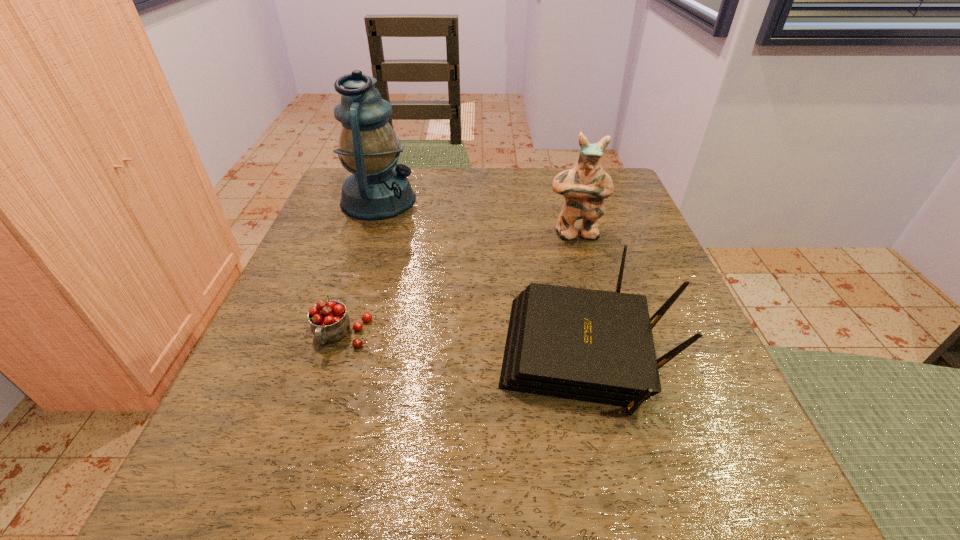
I want to click on cherry located at the left edge, so click(329, 321).

I want to click on figurine that is at the right edge, so click(x=584, y=187).

Find the location of a particular element. This screenshot has width=960, height=540. router present at the right edge is located at coordinates (596, 346).

Identify the location of object located in the far left corner section of the desktop. The width and height of the screenshot is (960, 540). (368, 147).

At what (x,y) coordinates should I click in order to perform the action: click on free spot at the far edge of the desktop. Please return your answer as a coordinate pair (x, y). The image size is (960, 540). Looking at the image, I should click on (446, 195).

At what (x,y) coordinates should I click in order to perform the action: click on vacant space at the near edge of the desktop. Please return your answer as a coordinate pair (x, y). This screenshot has height=540, width=960. Looking at the image, I should click on (638, 482).

Image resolution: width=960 pixels, height=540 pixels. In order to click on vacant space at the left edge in this screenshot , I will do `click(361, 264)`.

Locate an element on the screen. free space at the right edge of the desktop is located at coordinates (657, 400).

Where is `free space at the far left corner of the desktop`? The width and height of the screenshot is (960, 540). free space at the far left corner of the desktop is located at coordinates (326, 200).

Where is `vacant point located between the tallest object and the shortest object`? This screenshot has height=540, width=960. vacant point located between the tallest object and the shortest object is located at coordinates (360, 268).